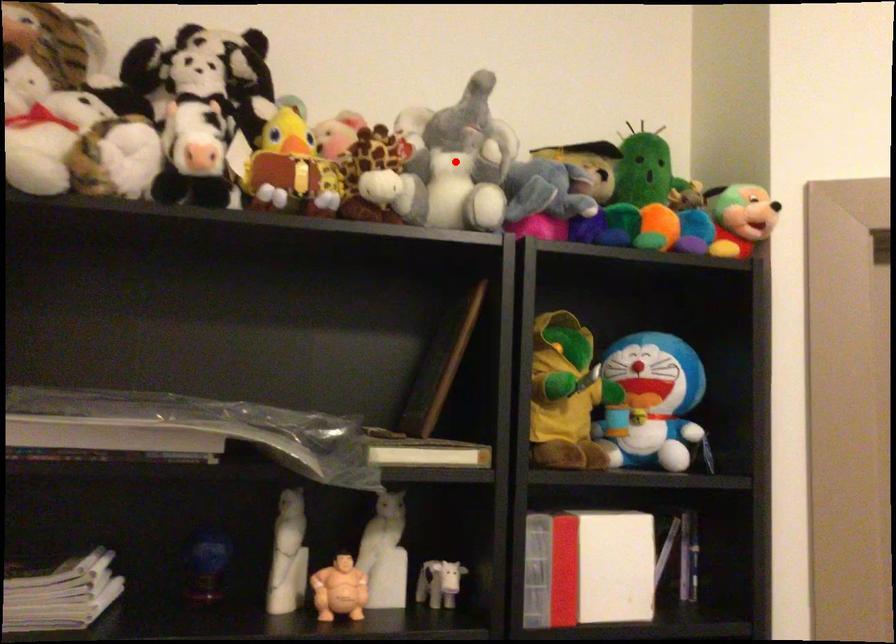
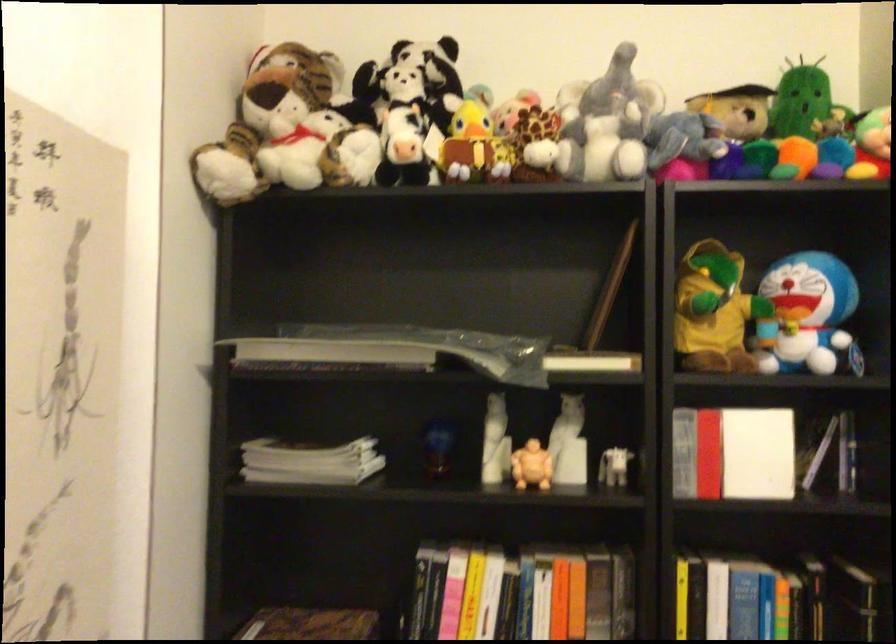
In the second image, find the point that corresponds to the highlighted location in the first image.

(607, 122)